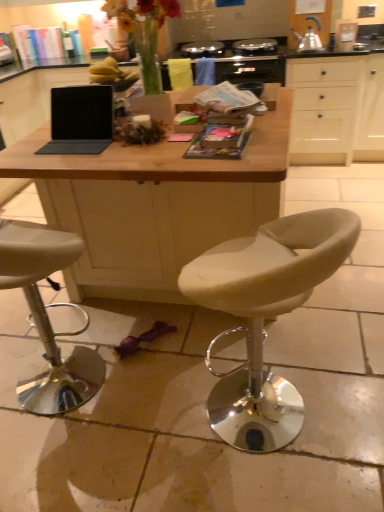
This screenshot has height=512, width=384. What are the coordinates of `vacant area that is in front of matte black laptop at center` in the screenshot? It's located at (84, 166).